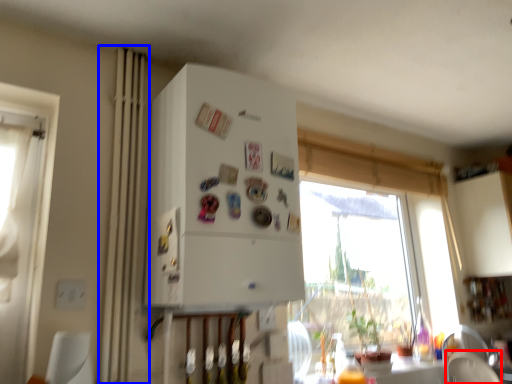
Question: Which object is closer to the camera taking this photo, armchair (highlighted by a red box) or curtain (highlighted by a blue box)?

Choices:
 (A) armchair
 (B) curtain

Answer: (B)